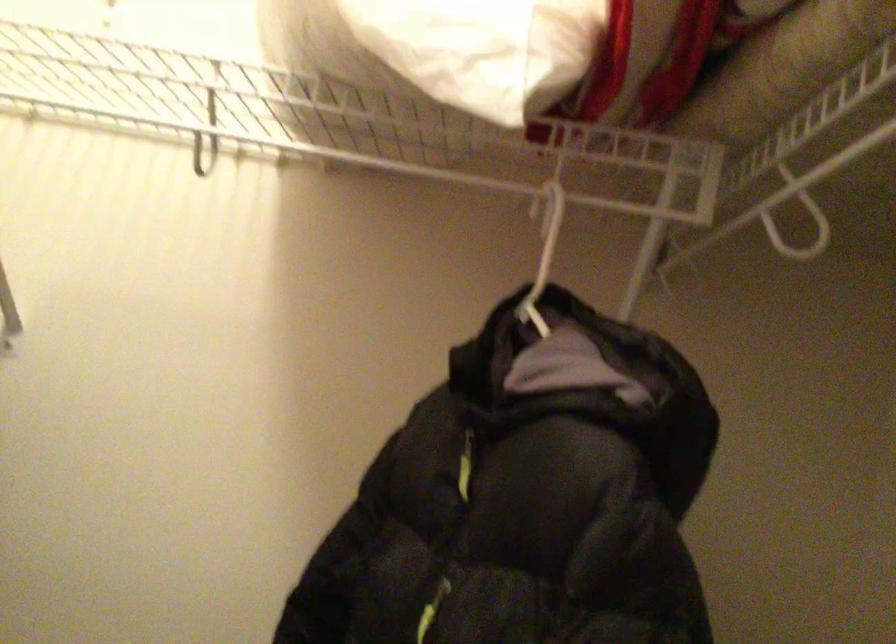
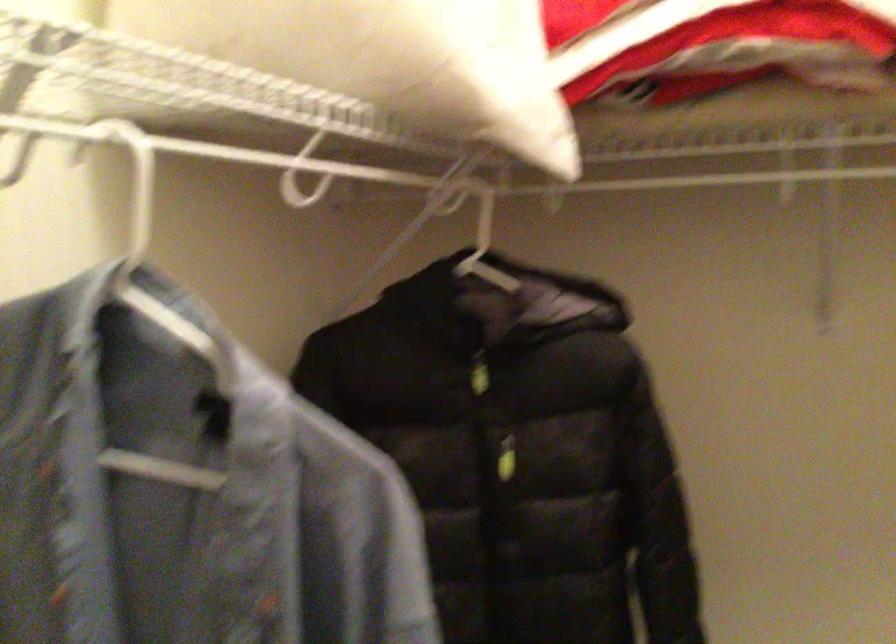
The first image is from the beginning of the video and the second image is from the end. How did the camera likely rotate when shooting the video?

The camera rotated toward right-down.